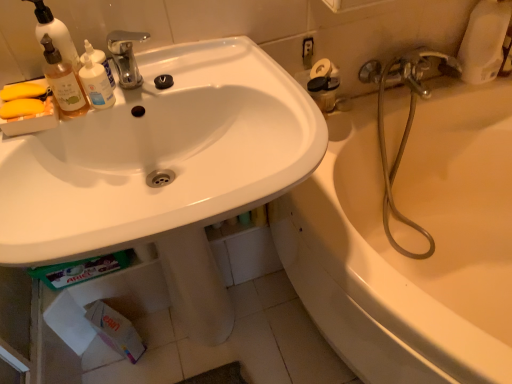
Question: From the image's perspective, is polished chrome faucet at upper center above or below white matte soap dispenser at upper left?

Choices:
 (A) above
 (B) below

Answer: (B)

Question: Would you say polished chrome faucet at upper center is inside or outside white matte soap dispenser at upper left?

Choices:
 (A) inside
 (B) outside

Answer: (B)

Question: Estimate the real-world distances between objects in this image. Which object is farther from the satin nickel faucet at upper right, which is the first plumbing fixture in back-to-front order?

Choices:
 (A) white matte soap dispenser at upper left
 (B) white matte toilet paper at lower left
 (C) metallic hose at right, acting as the second plumbing fixture starting from the back
 (D) translucent glass bottle at upper left
 (E) polished chrome faucet at upper center

Answer: (B)

Question: Which is nearer to the translucent glass bottle at upper left?

Choices:
 (A) white glossy bathtub at right
 (B) translucent plastic bottle at upper left
 (C) polished chrome faucet at upper center
 (D) white matte soap dispenser at upper left
 (E) white glossy sink at upper left

Answer: (D)